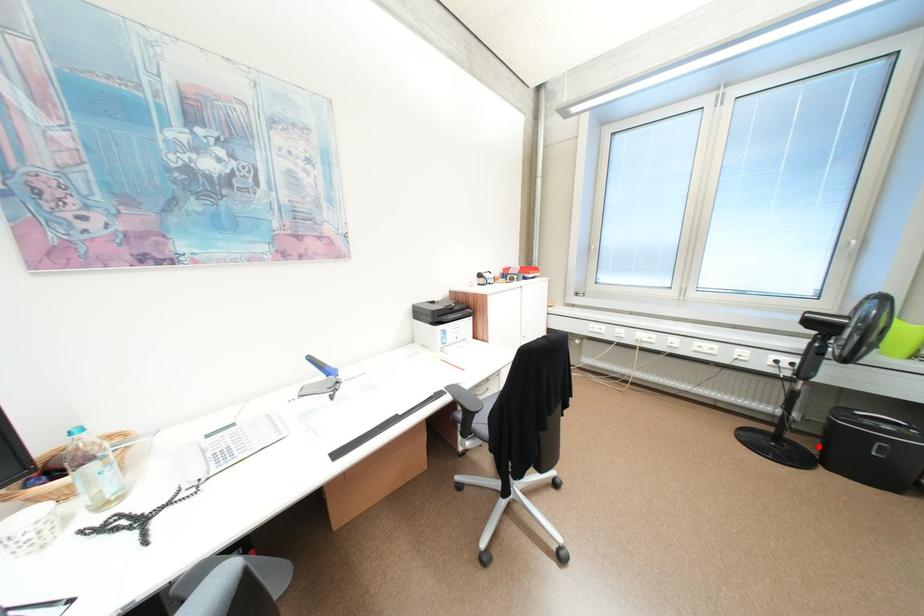
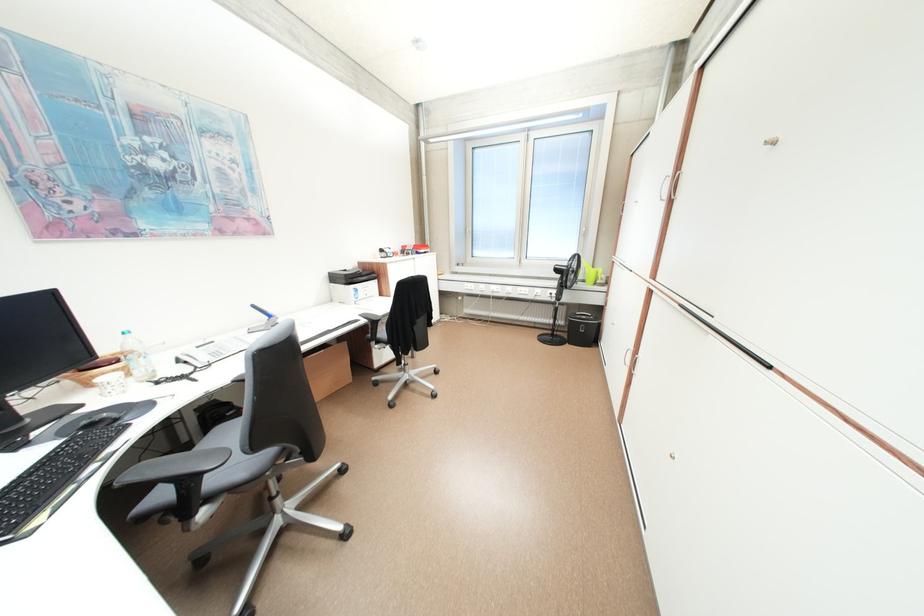
Question: I am providing you with two images of the same scene from different viewpoints. Given a red point in image1, look at the same physical point in image2. Is it:

Choices:
 (A) Closer to the viewpoint
 (B) Farther from the viewpoint

Answer: (B)